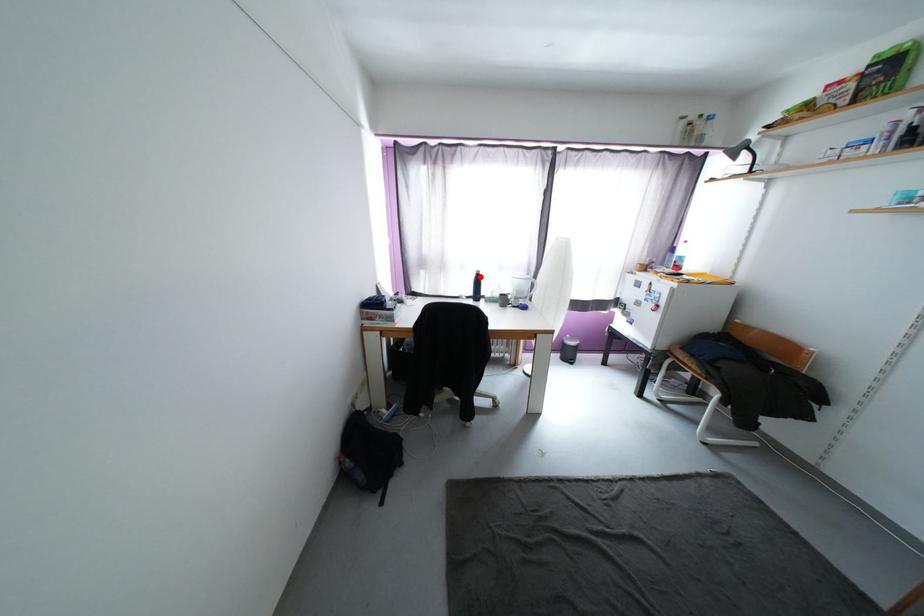
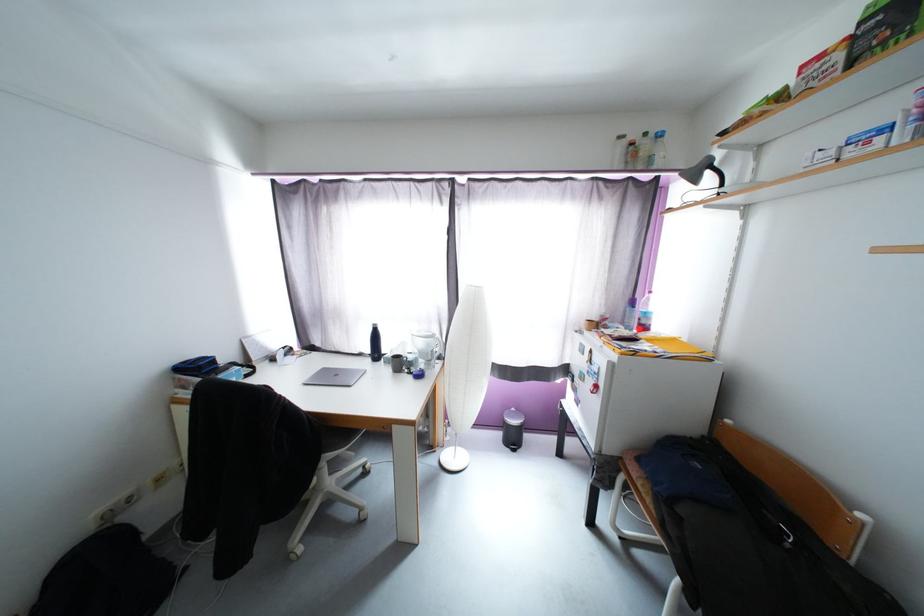
Locate, in the second image, the point that corresponds to the highlighted location in the first image.

(377, 331)